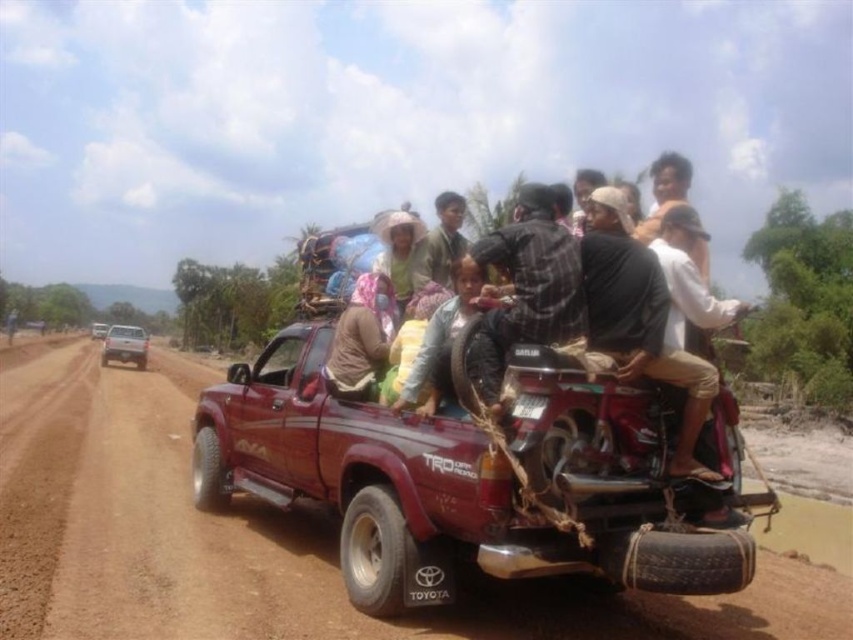
Can you confirm if brown dirt track at center is smaller than metallic silver pickup truck at center-left?

No, brown dirt track at center is not smaller than metallic silver pickup truck at center-left.

Is point (190, 602) behind point (96, 330)?

No, (190, 602) is closer to viewer.

The height and width of the screenshot is (640, 853). What are the coordinates of `brown dirt track at center` in the screenshot? It's located at 263,538.

Is brown fabric bag at center to the left of metallic silver pickup truck at center-left from the viewer's perspective?

No, brown fabric bag at center is not to the left of metallic silver pickup truck at center-left.

At what (x,y) coordinates should I click in order to perform the action: click on brown fabric bag at center. Please return your answer as a coordinate pair (x, y). Image resolution: width=853 pixels, height=640 pixels. Looking at the image, I should click on (363, 337).

I want to click on brown fabric bag at center, so click(x=363, y=337).

Does light blue fabric at center appear on the right side of dark gray fabric shirt at center?

In fact, light blue fabric at center is to the left of dark gray fabric shirt at center.

Between light blue fabric at center and dark gray fabric shirt at center, which one is positioned lower?

light blue fabric at center is below.

Identify the location of light blue fabric at center. (440, 339).